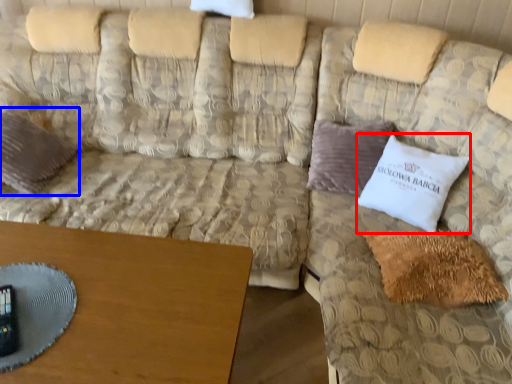
Question: Which point is closer to the camera, pillow (highlighted by a red box) or pillow (highlighted by a blue box)?

Choices:
 (A) pillow
 (B) pillow

Answer: (A)